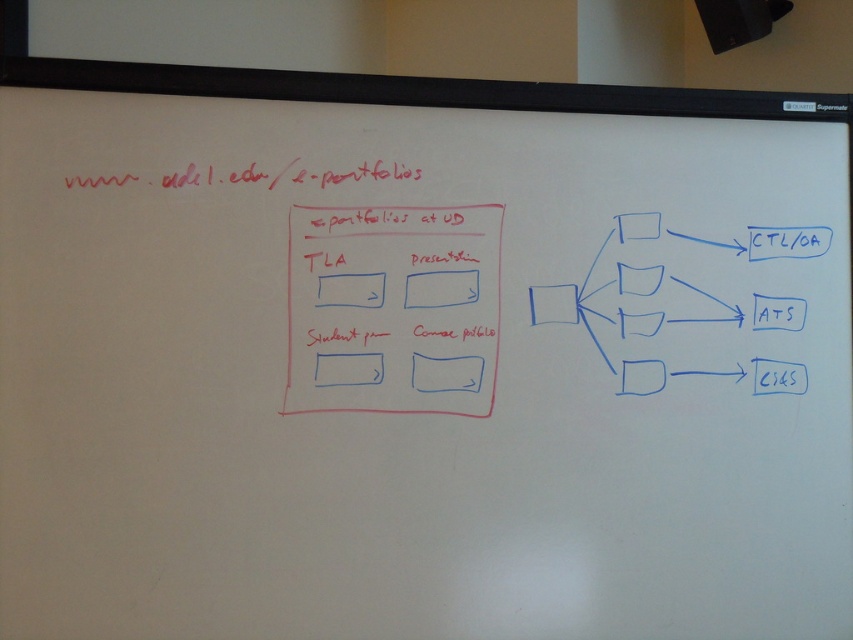
Question: Which object is farther from the camera taking this photo?

Choices:
 (A) white paper at center
 (B) white matte presentation at center

Answer: (B)

Question: Is white matte presentation at center thinner than white paper at center?

Choices:
 (A) yes
 (B) no

Answer: (B)

Question: Which is farther from the white matte presentation at center?

Choices:
 (A) white matte square at center
 (B) white paper at center

Answer: (B)

Question: Which is farther from the white matte square at center?

Choices:
 (A) white paper at center
 (B) white matte presentation at center

Answer: (A)

Question: Is white matte presentation at center bigger than white matte square at center?

Choices:
 (A) yes
 (B) no

Answer: (A)

Question: Does white matte presentation at center have a greater width compared to white paper at center?

Choices:
 (A) yes
 (B) no

Answer: (A)